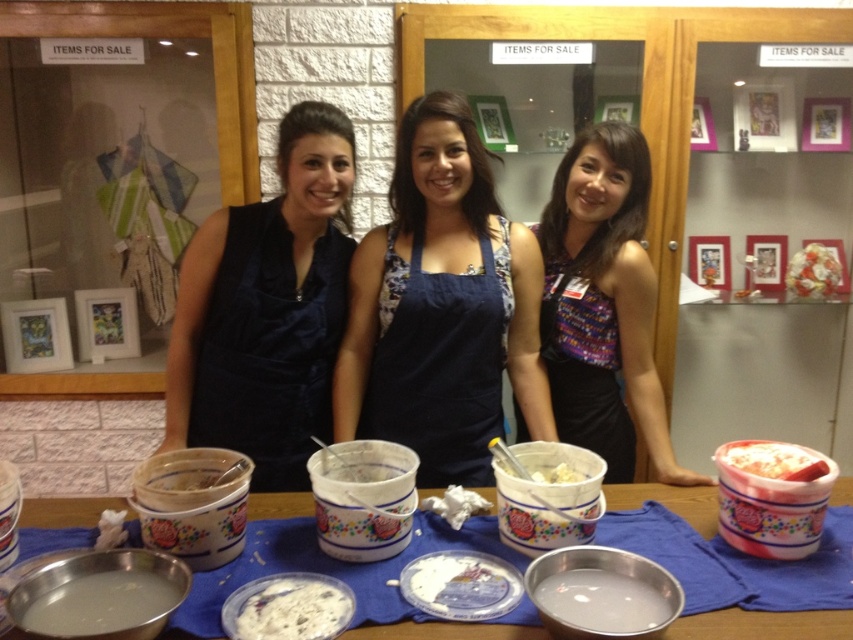
Question: Does pink creamy ice cream at center appear under white creamy ice cream at center?

Choices:
 (A) yes
 (B) no

Answer: (B)

Question: Which point is closer to the camera?

Choices:
 (A) translucent plastic bowl at lower left
 (B) metallic bowls at center

Answer: (A)

Question: Which point is farther to the camera?

Choices:
 (A) (378, 365)
 (B) (299, 289)
 (C) (415, 406)

Answer: (A)

Question: Which of the following is the farthest from the observer?

Choices:
 (A) white creamy ice cream at center
 (B) matte blue dress at center
 (C) patterned fabric dress at center

Answer: (B)

Question: Does pink creamy ice cream at center have a lesser width compared to white creamy food at center?

Choices:
 (A) yes
 (B) no

Answer: (B)

Question: Is matte blue dress at center to the left of white matte liquid at lower center from the viewer's perspective?

Choices:
 (A) no
 (B) yes

Answer: (B)